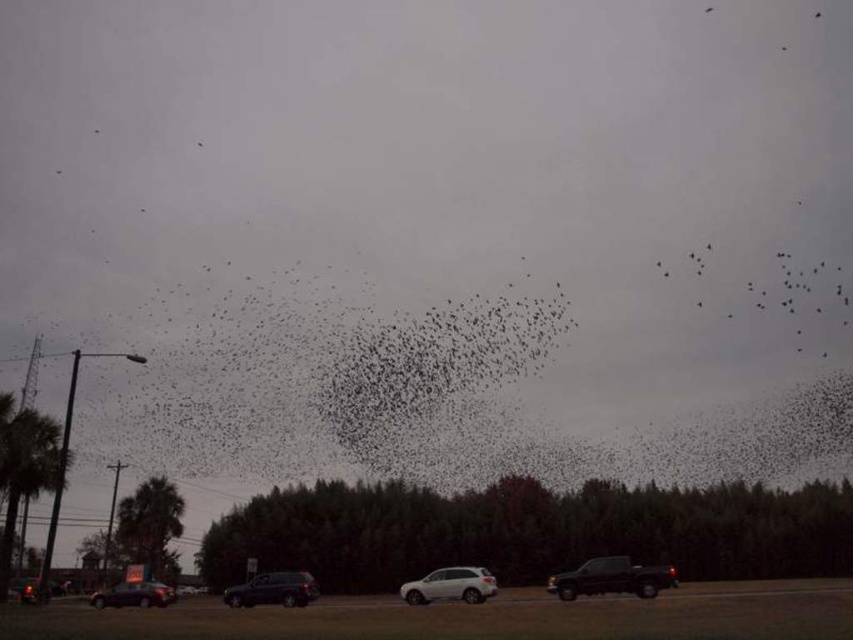
Question: Which point is closer to the camera?

Choices:
 (A) black matte truck at lower right
 (B) white matte suv at center
 (C) shiny black suv at center

Answer: (A)

Question: Which of these objects is positioned farthest from the shiny black suv at center?

Choices:
 (A) shiny black sedan at lower left
 (B) white matte suv at center

Answer: (B)

Question: Does black matte truck at lower right appear under shiny black sedan at lower left?

Choices:
 (A) yes
 (B) no

Answer: (B)

Question: Which of the following is the closest to the observer?

Choices:
 (A) (131, 602)
 (B) (234, 605)
 (C) (466, 572)
 (D) (592, 579)

Answer: (D)

Question: Does white matte suv at center have a larger size compared to shiny black sedan at lower left?

Choices:
 (A) yes
 (B) no

Answer: (B)

Question: Is white matte suv at center closer to camera compared to shiny black sedan at lower left?

Choices:
 (A) yes
 (B) no

Answer: (A)